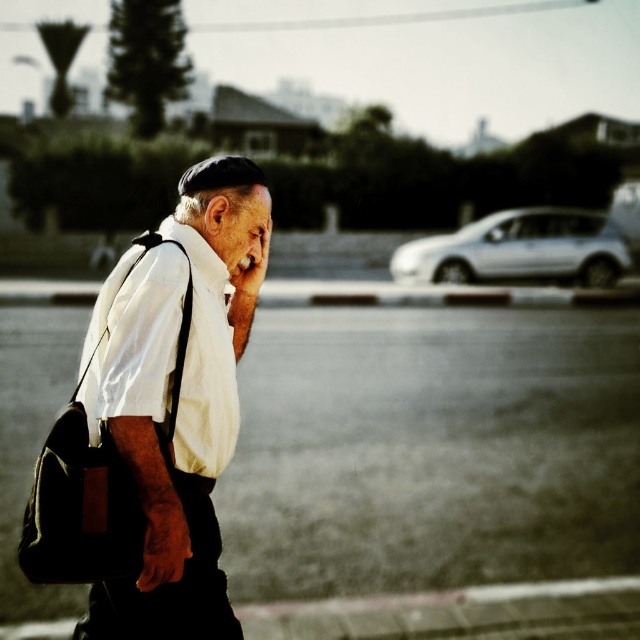
Looking at this image, can you confirm if smooth asphalt road at center is thinner than white cotton shirt at left?

Incorrect, smooth asphalt road at center's width is not less than white cotton shirt at left's.

At what (x,y) coordinates should I click in order to perform the action: click on smooth asphalt road at center. Please return your answer as a coordinate pair (x, y). This screenshot has height=640, width=640. Looking at the image, I should click on (x=432, y=451).

The width and height of the screenshot is (640, 640). I want to click on smooth asphalt road at center, so click(x=432, y=451).

Which is more to the left, white matte dress shirt at center or black leather messenger bag at left?

Positioned to the left is black leather messenger bag at left.

Can you confirm if white matte dress shirt at center is wider than black leather messenger bag at left?

Incorrect, white matte dress shirt at center's width does not surpass black leather messenger bag at left's.

What do you see at coordinates (132, 337) in the screenshot? I see `white matte dress shirt at center` at bounding box center [132, 337].

What are the coordinates of `white matte dress shirt at center` in the screenshot? It's located at (132, 337).

Based on the photo, who is taller, smooth asphalt road at center or white matte dress shirt at center?

smooth asphalt road at center

Based on the photo, is smooth asphalt road at center positioned behind white matte dress shirt at center?

Yes.

Which is in front, point (600, 378) or point (216, 282)?

Point (216, 282) is more forward.

You are a GUI agent. You are given a task and a screenshot of the screen. Output one action in this format:
    pyautogui.click(x=<x>, y=<y>)
    Task: Click on the smooth asphalt road at center
    The height and width of the screenshot is (640, 640).
    Given the screenshot: What is the action you would take?
    pyautogui.click(x=432, y=451)